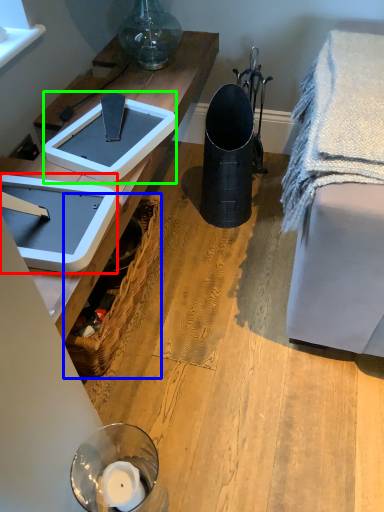
Question: Which is nearer to the weight scale (highlighted by a red box)? picnic basket (highlighted by a blue box) or weight scale (highlighted by a green box).

Choices:
 (A) picnic basket
 (B) weight scale

Answer: (B)